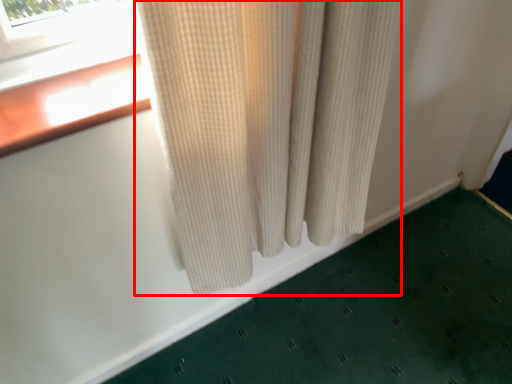
Question: Observing the image, what is the correct spatial positioning of curtain (annotated by the red box) in reference to bath mat?

Choices:
 (A) left
 (B) right

Answer: (A)